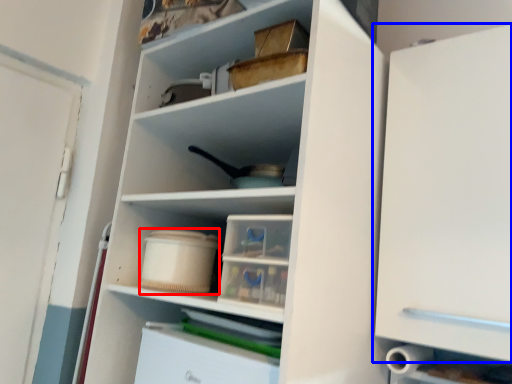
Question: Among these objects, which one is nearest to the camera, storage box (highlighted by a red box) or cabinetry (highlighted by a blue box)?

Choices:
 (A) storage box
 (B) cabinetry

Answer: (B)